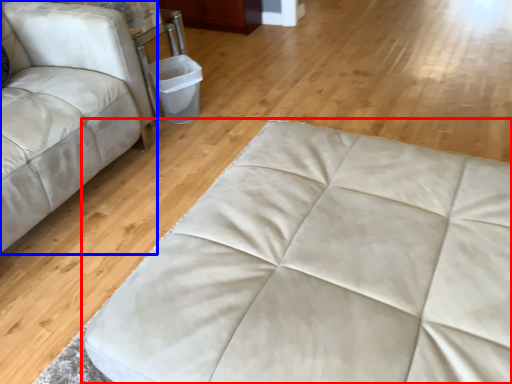
Question: Which object is closer to the camera taking this photo, furniture (highlighted by a red box) or studio couch (highlighted by a blue box)?

Choices:
 (A) furniture
 (B) studio couch

Answer: (A)